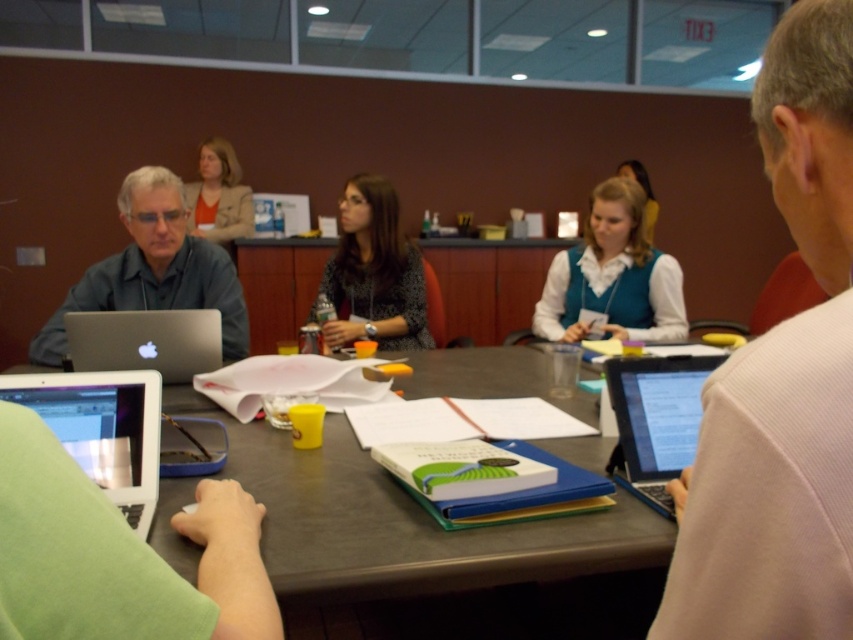
Question: Does white matte vest at center lie in front of matte beige blazer at upper center?

Choices:
 (A) no
 (B) yes

Answer: (B)

Question: Which of the following is the closest to the observer?

Choices:
 (A) white glossy laptop at lower left
 (B) pink fabric shirt at upper right

Answer: (B)

Question: Which object appears farthest from the camera in this image?

Choices:
 (A) pink fabric shirt at upper right
 (B) smooth gray table at center
 (C) white matte vest at center
 (D) silver metallic laptop at right

Answer: (C)

Question: Can you confirm if pink fabric shirt at upper right is wider than white matte vest at center?

Choices:
 (A) yes
 (B) no

Answer: (B)

Question: Which of these objects is positioned closest to the silver metallic laptop at right?

Choices:
 (A) smooth gray table at center
 (B) white glossy laptop at lower left

Answer: (A)

Question: Does smooth gray table at center have a greater width compared to matte black shirt at center?

Choices:
 (A) no
 (B) yes

Answer: (B)